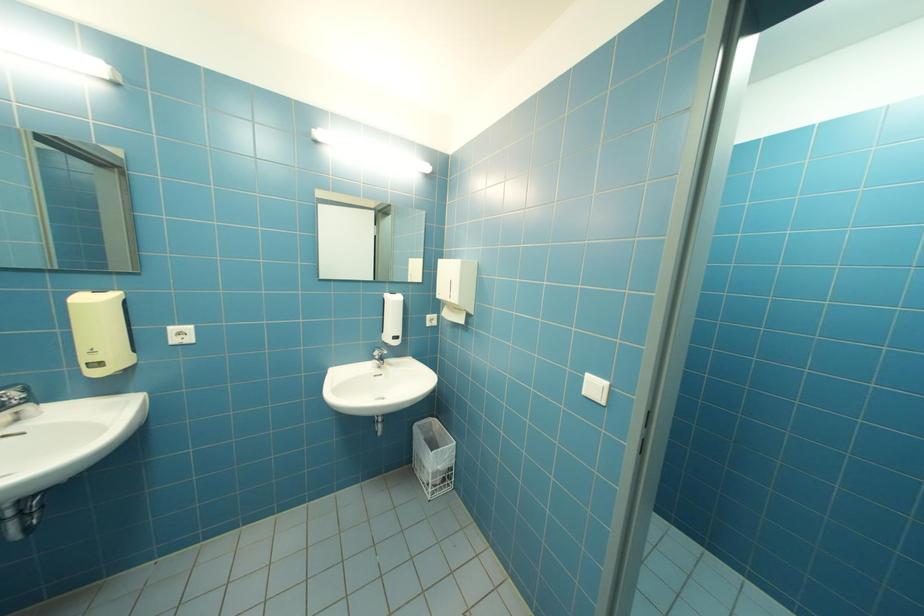
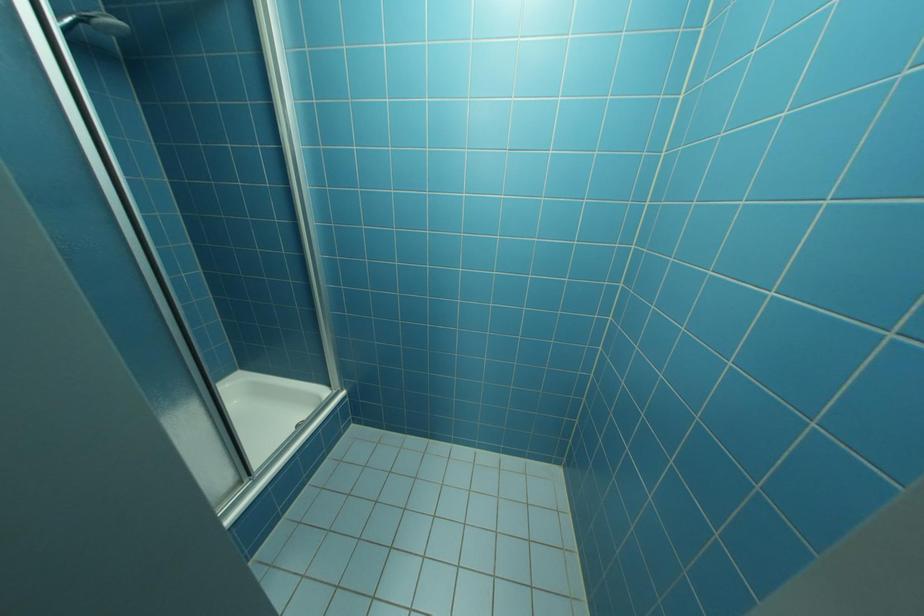
Based on the continuous images, in which direction is the camera rotating?

The camera's rotation is toward right-down.